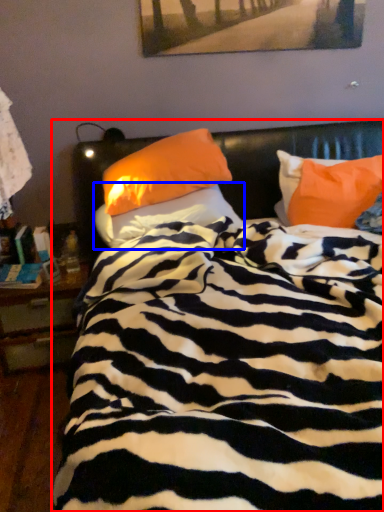
Question: Which object is further to the camera taking this photo, bed (highlighted by a red box) or pillow (highlighted by a blue box)?

Choices:
 (A) bed
 (B) pillow

Answer: (B)